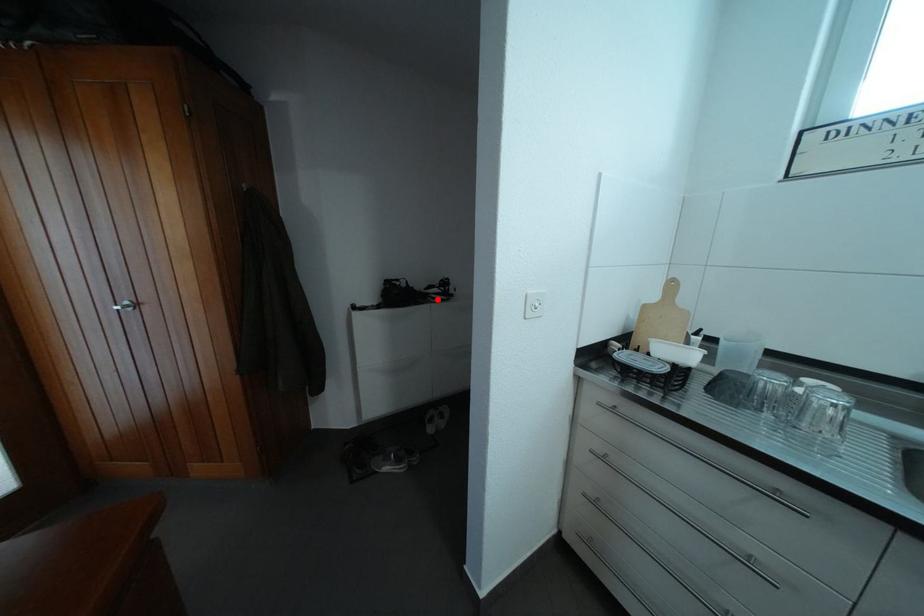
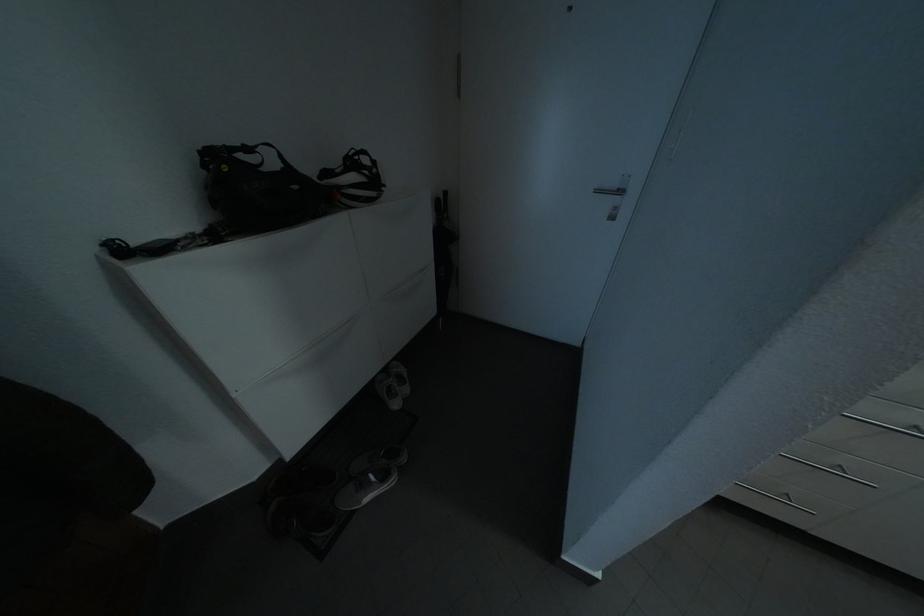
Find the pixel in the second image that matches the highlighted location in the first image.

(348, 193)